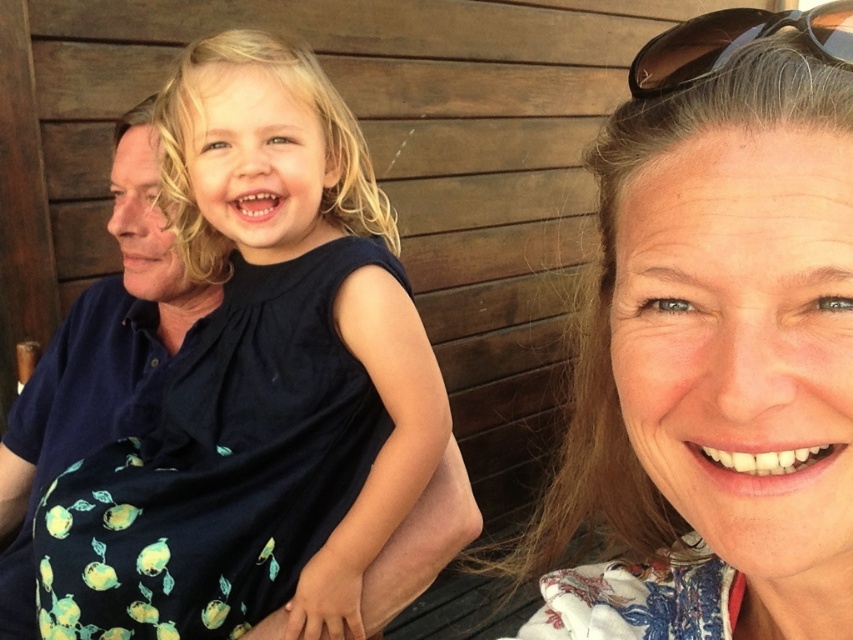
You are a photographer standing in front of the scene. You want to take a closeup shot of the floral fabric at upper right without moving the camera. Can you reach it with your 100mm lens? Explain why or why not.

The floral fabric at upper right is 12.59 inches away from the viewer. A 100mm lens has a focal length that allows for capturing subjects within a range that includes 12.59 inches, so yes, you can take a closeup shot of the floral fabric at upper right without moving the camera.

Looking at this image, in the image, there are three people sitting together. The child in the dark blue sleeveless dress at center is between two adults. The adult on the left has short wavy hair and a navy blue shirt, and the adult on the right has shoulder length brown hair and a floral top. Now, you are given a coordinate point at (x=260, y=384). Can you determine which object from the scene is located exactly at this coordinate?

The dark blue fabric dress at center is located at point (x=260, y=384).

You are standing in front of the image and want to place a sticker exactly at the point marked as point (717, 348). Which object in the scene is this point located on?

The point (717, 348) is located on the floral fabric at upper right.